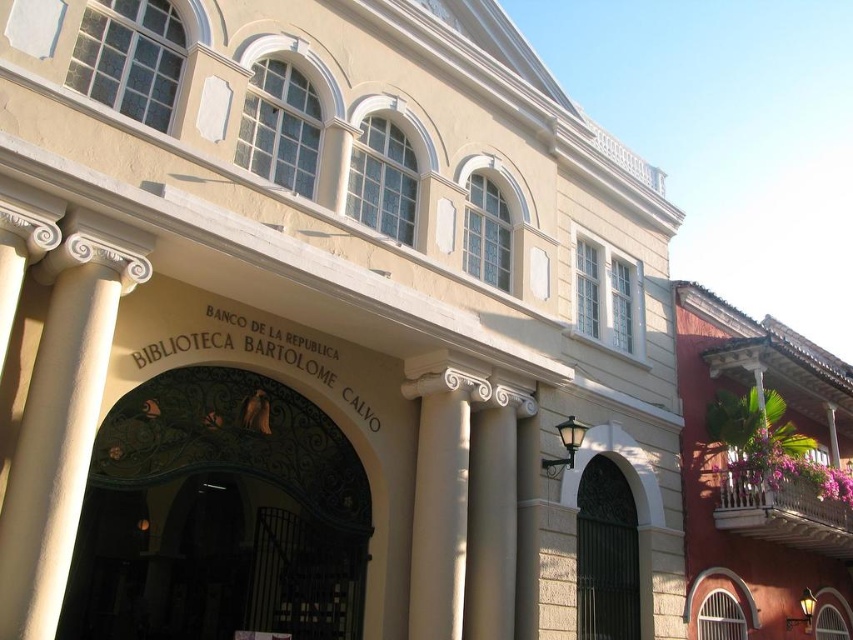
From the picture: You are standing in front of the Biblioteca Bartolome Calvo and want to locate the point at coordinates (x=62, y=417). According to the image, where exactly is this point located?

The point at coordinates (x=62, y=417) is on the white glossy column at center.

You are a visitor approaching the entrance of the Biblioteca Bartolome Calvo. You notice the white glossy column at center and the dark metal gate at center. Which object is larger in size?

The white glossy column at center is bigger than the dark metal gate at center.